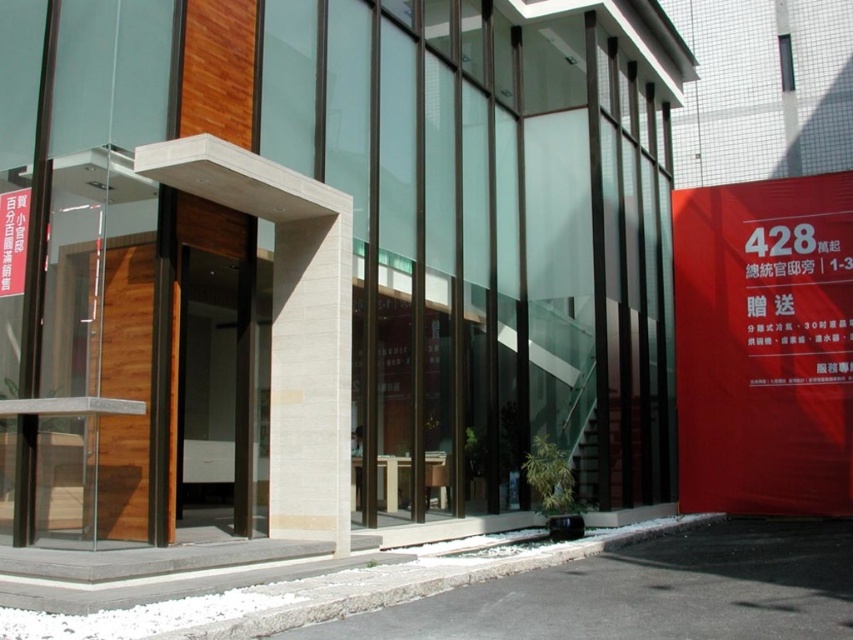
Question: Where is red matte sign at right located in relation to brown wooden door at center in the image?

Choices:
 (A) below
 (B) above

Answer: (B)

Question: Does red matte sign at right lie behind brown wooden door at center?

Choices:
 (A) no
 (B) yes

Answer: (B)

Question: Is red matte sign at right below brown wooden door at center?

Choices:
 (A) yes
 (B) no

Answer: (B)

Question: Which point is closer to the camera?

Choices:
 (A) brown wooden door at center
 (B) red matte sign at right

Answer: (A)

Question: Which point is farther to the camera?

Choices:
 (A) red matte sign at right
 (B) brown wooden door at center

Answer: (A)